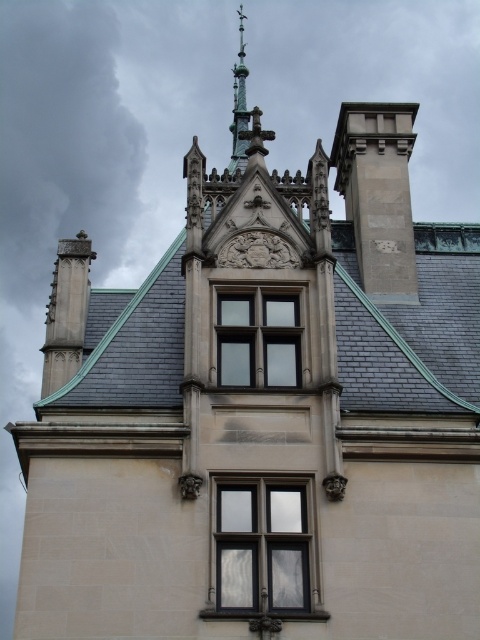
Question: From the image, what is the correct spatial relationship of clear glass window at center in relation to matte glass window at center?

Choices:
 (A) above
 (B) below

Answer: (B)

Question: Can you confirm if clear glass window at center is positioned below gray slate roof at center?

Choices:
 (A) yes
 (B) no

Answer: (A)

Question: Which of the following is the closest to the observer?

Choices:
 (A) gray slate roof at center
 (B) clear glass window at center

Answer: (B)

Question: Which of the following is the closest to the observer?

Choices:
 (A) clear glass window at center
 (B) gray slate roof at center

Answer: (A)

Question: Which point is farther to the camera?

Choices:
 (A) (429, 376)
 (B) (280, 328)
 (C) (212, 493)

Answer: (A)

Question: Is clear glass window at center thinner than matte glass window at center?

Choices:
 (A) no
 (B) yes

Answer: (B)